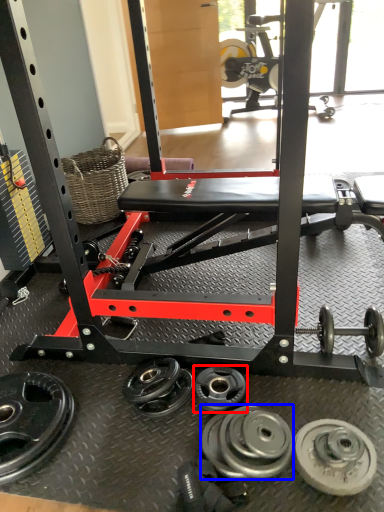
Question: Which point is further to the camera, wheel (highlighted by a red box) or wheel (highlighted by a blue box)?

Choices:
 (A) wheel
 (B) wheel

Answer: (A)